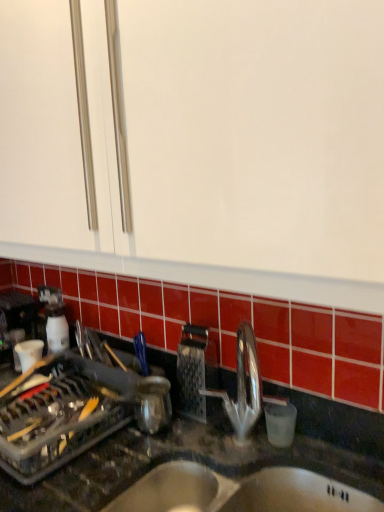
Question: Considering the relative sizes of metallic grater at center and stainless steel sink at lower center in the image provided, is metallic grater at center bigger than stainless steel sink at lower center?

Choices:
 (A) no
 (B) yes

Answer: (A)

Question: Can you confirm if metallic grater at center is taller than stainless steel sink at lower center?

Choices:
 (A) yes
 (B) no

Answer: (A)

Question: Is stainless steel sink at lower center located within metallic grater at center?

Choices:
 (A) yes
 (B) no

Answer: (B)

Question: Considering the relative sizes of metallic grater at center and stainless steel sink at lower center in the image provided, is metallic grater at center thinner than stainless steel sink at lower center?

Choices:
 (A) yes
 (B) no

Answer: (A)

Question: From the image's perspective, is metallic grater at center located above stainless steel sink at lower center?

Choices:
 (A) yes
 (B) no

Answer: (A)

Question: From a real-world perspective, is metallic grater at center physically located above or below stainless steel sink at lower center?

Choices:
 (A) above
 (B) below

Answer: (A)

Question: From the image's perspective, is metallic grater at center above or below stainless steel sink at lower center?

Choices:
 (A) below
 (B) above

Answer: (B)

Question: Visually, is metallic grater at center positioned to the left or to the right of stainless steel sink at lower center?

Choices:
 (A) left
 (B) right

Answer: (A)

Question: Is metallic grater at center situated inside stainless steel sink at lower center or outside?

Choices:
 (A) outside
 (B) inside

Answer: (A)

Question: In terms of height, does black granite countertop at center look taller or shorter compared to metallic grater at center?

Choices:
 (A) tall
 (B) short

Answer: (A)

Question: Is black granite countertop at center wider or thinner than metallic grater at center?

Choices:
 (A) wide
 (B) thin

Answer: (A)

Question: From a real-world perspective, is black granite countertop at center above or below metallic grater at center?

Choices:
 (A) below
 (B) above

Answer: (A)

Question: Looking at the image, does black granite countertop at center seem bigger or smaller compared to metallic grater at center?

Choices:
 (A) big
 (B) small

Answer: (A)

Question: From the image's perspective, is metallic grater at center located above or below black granite countertop at center?

Choices:
 (A) below
 (B) above

Answer: (B)

Question: Visually, is metallic grater at center positioned to the left or to the right of black granite countertop at center?

Choices:
 (A) left
 (B) right

Answer: (B)